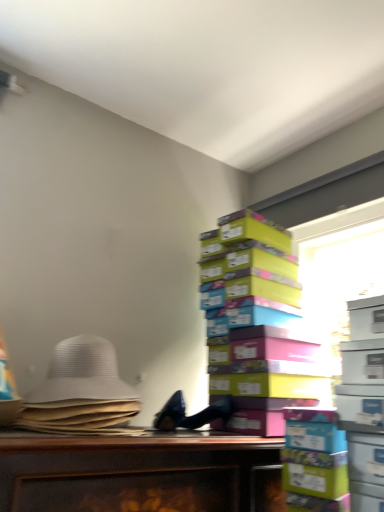
Question: Is transparent plastic window screen at upper right aimed at white fabric hat at left?

Choices:
 (A) yes
 (B) no

Answer: (A)

Question: Is the surface of transparent plastic window screen at upper right in direct contact with white fabric hat at left?

Choices:
 (A) no
 (B) yes

Answer: (A)

Question: Is transparent plastic window screen at upper right oriented away from white fabric hat at left?

Choices:
 (A) no
 (B) yes

Answer: (A)

Question: Would you say transparent plastic window screen at upper right contains white fabric hat at left?

Choices:
 (A) yes
 (B) no

Answer: (B)

Question: Considering the relative sizes of transparent plastic window screen at upper right and white fabric hat at left in the image provided, is transparent plastic window screen at upper right smaller than white fabric hat at left?

Choices:
 (A) no
 (B) yes

Answer: (A)

Question: Is point (213, 313) positioned closer to the camera than point (327, 295)?

Choices:
 (A) farther
 (B) closer

Answer: (B)

Question: Considering the positions of multicolored cardboard boxes at right and transparent plastic window screen at upper right in the image, is multicolored cardboard boxes at right wider or thinner than transparent plastic window screen at upper right?

Choices:
 (A) wide
 (B) thin

Answer: (A)

Question: From the image's perspective, is multicolored cardboard boxes at right positioned above or below transparent plastic window screen at upper right?

Choices:
 (A) below
 (B) above

Answer: (A)

Question: From a real-world perspective, is multicolored cardboard boxes at right positioned above or below transparent plastic window screen at upper right?

Choices:
 (A) below
 (B) above

Answer: (A)

Question: From the image's perspective, is white fabric hat at left positioned above or below transparent plastic window screen at upper right?

Choices:
 (A) above
 (B) below

Answer: (B)

Question: Considering the positions of point (72, 344) and point (334, 254), is point (72, 344) closer or farther from the camera than point (334, 254)?

Choices:
 (A) closer
 (B) farther

Answer: (A)

Question: Based on their sizes in the image, would you say white fabric hat at left is bigger or smaller than transparent plastic window screen at upper right?

Choices:
 (A) big
 (B) small

Answer: (B)

Question: Would you say white fabric hat at left is inside or outside transparent plastic window screen at upper right?

Choices:
 (A) outside
 (B) inside

Answer: (A)

Question: From a real-world perspective, is white fabric hat at left positioned above or below multicolored cardboard boxes at right?

Choices:
 (A) above
 (B) below

Answer: (B)

Question: Looking at the image, does white fabric hat at left seem bigger or smaller compared to multicolored cardboard boxes at right?

Choices:
 (A) big
 (B) small

Answer: (B)